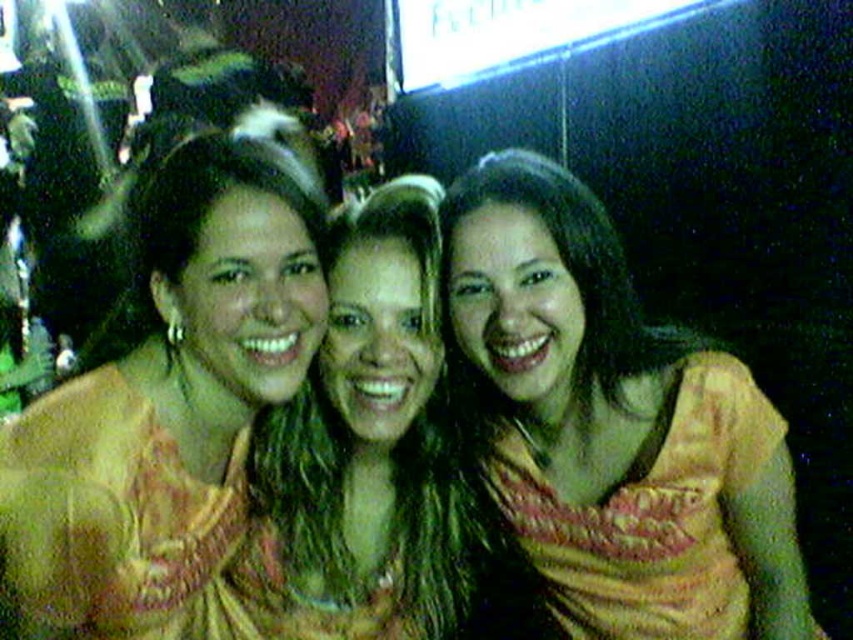
You are standing in front of the group of three people in the photo. You want to take a closer look at the two points marked in the image. Which point, point (x=695, y=346) or point (x=202, y=234), is closer to you?

Point (x=695, y=346) is closer to you because it is further to the camera than point (x=202, y=234).